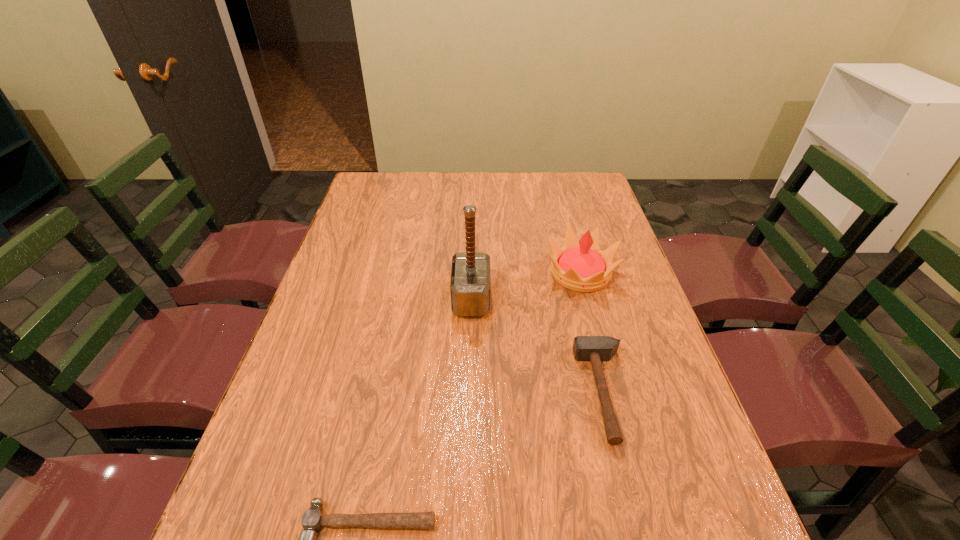
The width and height of the screenshot is (960, 540). Identify the location of the farthest hammer. (470, 287).

Locate an element on the screen. The image size is (960, 540). the second hammer from right to left is located at coordinates (470, 287).

Where is `crown`? crown is located at coordinates (583, 267).

Locate an element on the screen. The height and width of the screenshot is (540, 960). the second shortest object is located at coordinates (585, 348).

Image resolution: width=960 pixels, height=540 pixels. In order to click on the second nearest object in this screenshot , I will do `click(585, 348)`.

Image resolution: width=960 pixels, height=540 pixels. What are the coordinates of `free point located on the left of the third object from right to left` in the screenshot? It's located at (322, 299).

What are the coordinates of `blank space located on the back of the second tallest object` in the screenshot? It's located at (562, 202).

I want to click on vacant area located on the striking surface of the rightmost hammer, so click(424, 393).

At what (x,y) coordinates should I click in order to perform the action: click on free space located on the striking surface of the rightmost hammer. Please return your answer as a coordinate pair (x, y). This screenshot has width=960, height=540. Looking at the image, I should click on (500, 393).

Where is `vacant space situated on the striking surface of the rightmost hammer`? This screenshot has width=960, height=540. vacant space situated on the striking surface of the rightmost hammer is located at coordinates (420, 393).